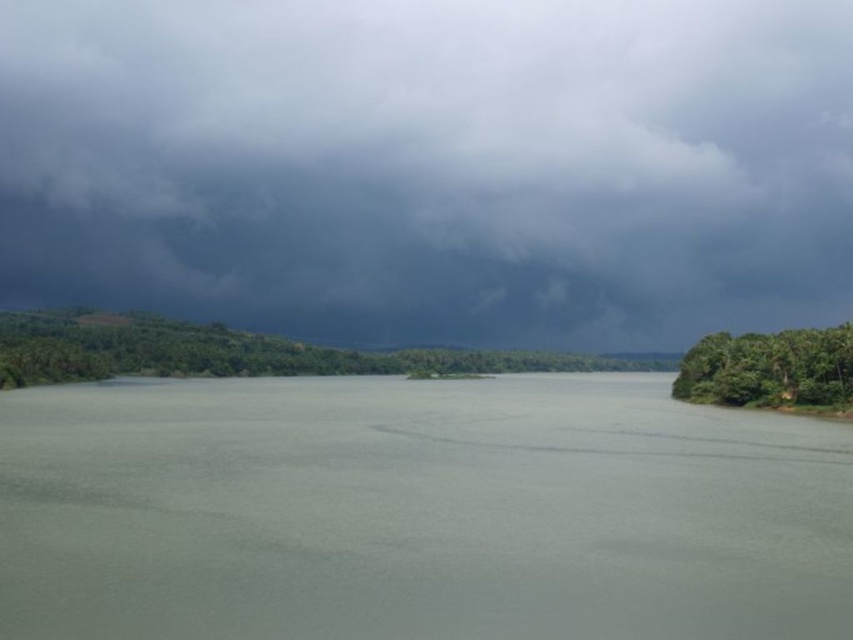
Is gray matte water at center in front of green leafy trees at center?

Yes, gray matte water at center is closer to the viewer.

Is point (509, 545) closer to viewer compared to point (51, 356)?

Yes, point (509, 545) is closer to viewer.

Where is `gray matte water at center`? gray matte water at center is located at coordinates (416, 512).

Consider the image. Who is higher up, dark gray cloud at upper center or gray matte water at center?

dark gray cloud at upper center

Does point (361, 244) come in front of point (532, 522)?

No, (361, 244) is behind (532, 522).

Does point (241, 108) come behind point (364, 605)?

Yes.

This screenshot has width=853, height=640. In order to click on dark gray cloud at upper center in this screenshot , I will do `click(432, 164)`.

Is dark gray cloud at upper center bigger than green leafy trees at right?

Yes.

Which is behind, point (614, 209) or point (744, 380)?

Point (614, 209)

Image resolution: width=853 pixels, height=640 pixels. What are the coordinates of `dark gray cloud at upper center` in the screenshot? It's located at (432, 164).